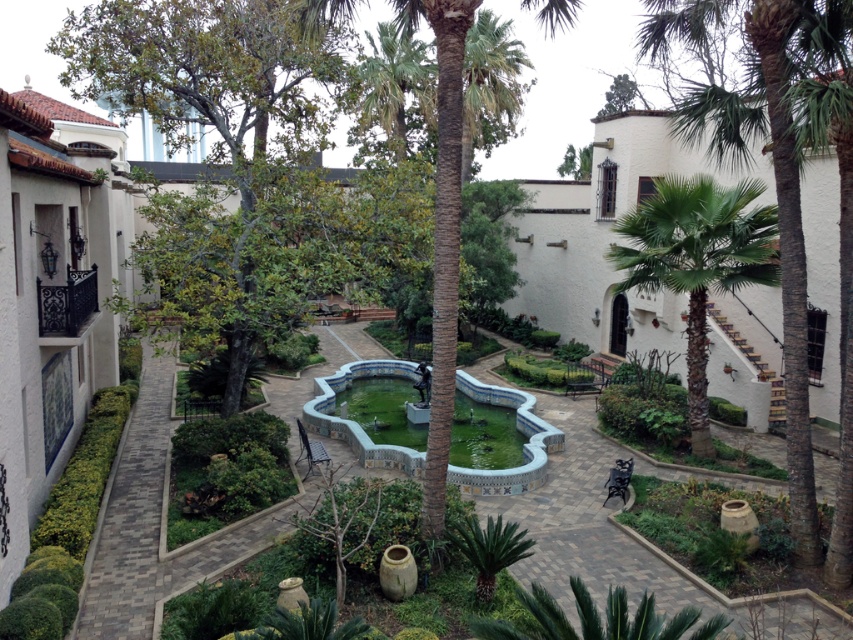
You are designing a garden layout and want to ensure proper spacing between the green leafy tree at left and the blue mosaic water at center. Which object has a greater width, requiring more space in the garden plan?

The green leafy tree at left has a greater width than the blue mosaic water at center, so it requires more space in the garden plan.

Looking at this image, you are standing in the courtyard and want to take a photo of the green leafy tree at left. If your camera has a maximum focus range of 40 feet, will it be able to capture a clear image of the tree?

The distance between you and the green leafy tree at left is 39.57 feet, which is within the camera maximum focus range of 40 feet. Therefore, the camera can capture a clear image of the tree.

You are standing in the courtyard and want to take a photo of the green leafy palm tree at right. Your camera has a maximum focus range of 15 meters. Will the camera be able to focus on the tree?

The distance between you and the green leafy palm tree at right is 14.55 meters, which is within the camera maximum focus range of 15 meters. Therefore, the camera can focus on the tree.